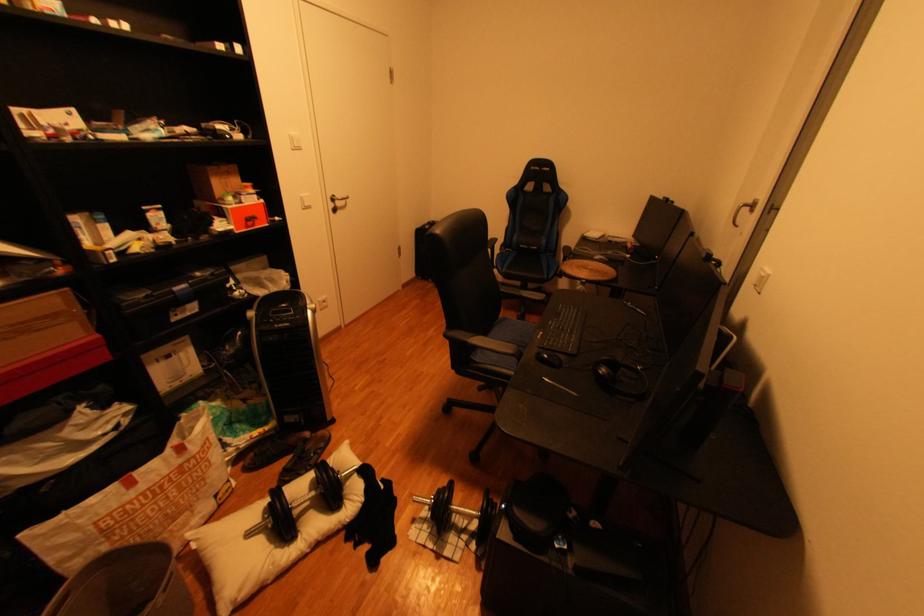
You are a GUI agent. You are given a task and a screenshot of the screen. Output one action in this format:
    pyautogui.click(x=<x>, y=<y>)
    Task: Click on the silver door handle
    This screenshot has height=616, width=924.
    Given the screenshot: What is the action you would take?
    pyautogui.click(x=337, y=199)